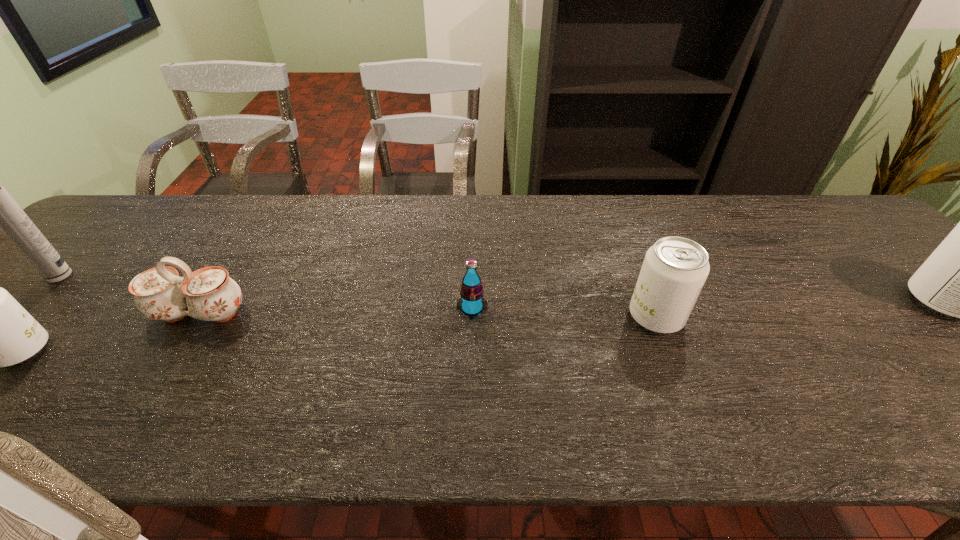
The image size is (960, 540). Identify the location of the second object from right to left. (674, 270).

The image size is (960, 540). Identify the location of the third shortest soda. (674, 270).

You are a GUI agent. You are given a task and a screenshot of the screen. Output one action in this format:
    pyautogui.click(x=<x>, y=<y>)
    Task: Click on the leftmost object
    The image size is (960, 540).
    Given the screenshot: What is the action you would take?
    pyautogui.click(x=0, y=211)

Image resolution: width=960 pixels, height=540 pixels. Identify the location of the tallest object. (0, 211).

Find the location of a particular element. The image size is (960, 540). the third object from left to right is located at coordinates (209, 294).

Where is `the third object from right to left`? Image resolution: width=960 pixels, height=540 pixels. the third object from right to left is located at coordinates (471, 303).

Where is `blank space located 0.050m on the left of the third shortest soda`? blank space located 0.050m on the left of the third shortest soda is located at coordinates (608, 316).

Identify the location of blank area located on the right of the tallest object. (172, 275).

Where is `free space located by the handle of the chinaware`? The image size is (960, 540). free space located by the handle of the chinaware is located at coordinates pyautogui.click(x=157, y=382).

Where is `free space located 0.310m on the back of the third object from right to left`? The image size is (960, 540). free space located 0.310m on the back of the third object from right to left is located at coordinates (473, 222).